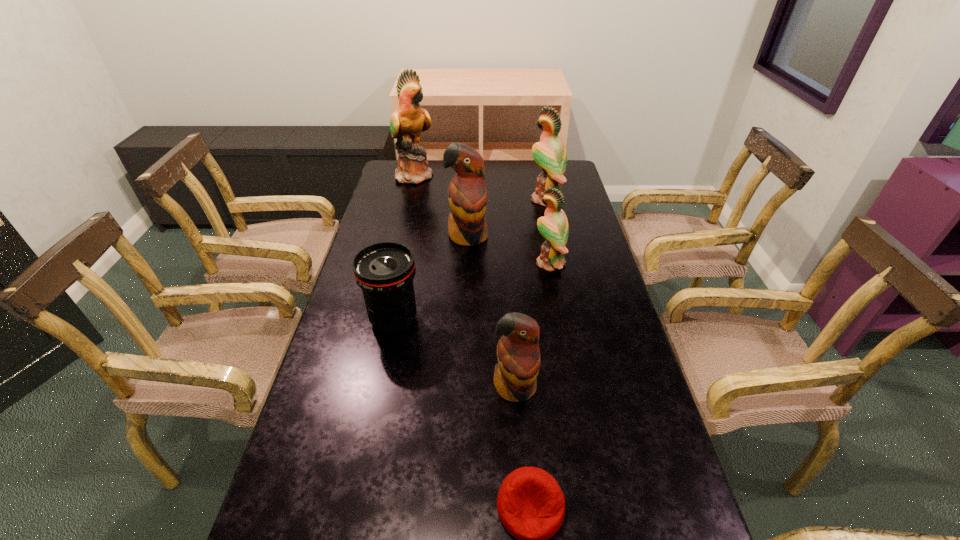
The width and height of the screenshot is (960, 540). What are the coordinates of `free space located on the face of the right red parrot` in the screenshot? It's located at (524, 517).

At what (x,y) coordinates should I click in order to perform the action: click on vacant area situated 0.080m on the front of the black telephoto lens. Please return your answer as a coordinate pair (x, y). Image resolution: width=960 pixels, height=540 pixels. Looking at the image, I should click on (385, 364).

Where is `object located at the far edge`? The width and height of the screenshot is (960, 540). object located at the far edge is located at coordinates (409, 120).

Where is `parrot positioned at the left edge`? This screenshot has width=960, height=540. parrot positioned at the left edge is located at coordinates (409, 120).

Image resolution: width=960 pixels, height=540 pixels. Find the location of `telephoto lens at the left edge`. telephoto lens at the left edge is located at coordinates (384, 271).

I want to click on object present at the far left corner, so click(409, 120).

You are a GUI agent. You are given a task and a screenshot of the screen. Output one action in this format:
    pyautogui.click(x=<x>, y=<y>)
    Task: Click on the vacant area at the far edge of the desktop
    The width and height of the screenshot is (960, 540).
    Given the screenshot: What is the action you would take?
    pyautogui.click(x=448, y=168)

I want to click on vacant area at the left edge, so [x=396, y=215].

The image size is (960, 540). Find the location of `vacant space at the right edge of the desktop`. vacant space at the right edge of the desktop is located at coordinates (590, 342).

Locate an element on the screen. The image size is (960, 540). vacant region between the third farthest parrot and the black telephoto lens is located at coordinates (431, 278).